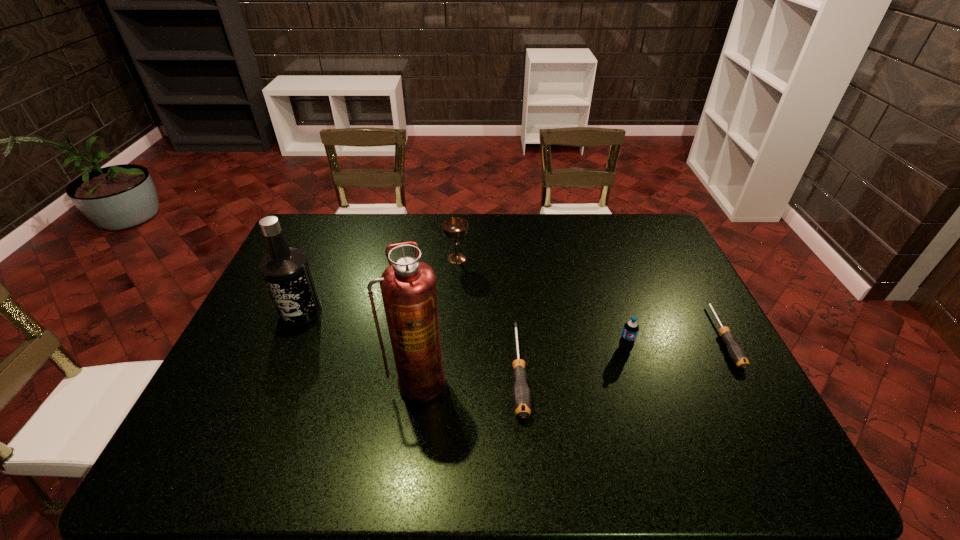
Find the location of `the taller screwdriver`. the taller screwdriver is located at coordinates (521, 396).

You are a GUI agent. You are given a task and a screenshot of the screen. Output one action in this format:
    pyautogui.click(x=<x>, y=<y>)
    Task: Click on the left screwdriver
    This screenshot has height=540, width=960.
    Given the screenshot: What is the action you would take?
    pyautogui.click(x=521, y=396)

Where is `the shorter screwdriver`? The height and width of the screenshot is (540, 960). the shorter screwdriver is located at coordinates tap(737, 354).

This screenshot has width=960, height=540. I want to click on the right screwdriver, so click(737, 354).

Image resolution: width=960 pixels, height=540 pixels. I want to click on chalice, so click(x=455, y=228).

You are a GUI agent. You are given a task and a screenshot of the screen. Output one action in this format:
    pyautogui.click(x=<x>, y=<y>)
    Task: Click on the fifth shortest object
    The image size is (960, 540).
    Given the screenshot: What is the action you would take?
    pyautogui.click(x=286, y=271)

I want to click on the leftmost object, so click(x=286, y=271).

At what (x,y) coordinates should I click in order to perform the action: click on soda bottle. Please return your answer as a coordinate pair (x, y). Image resolution: width=960 pixels, height=540 pixels. Looking at the image, I should click on (630, 330).

Where is `the fourth tallest object`? The height and width of the screenshot is (540, 960). the fourth tallest object is located at coordinates (630, 330).

This screenshot has height=540, width=960. I want to click on the tallest object, so click(408, 286).